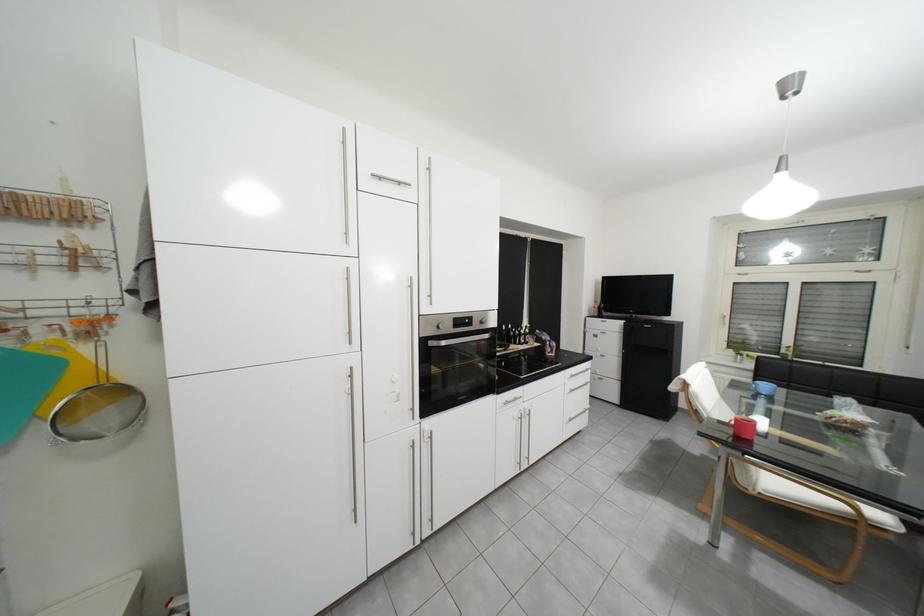
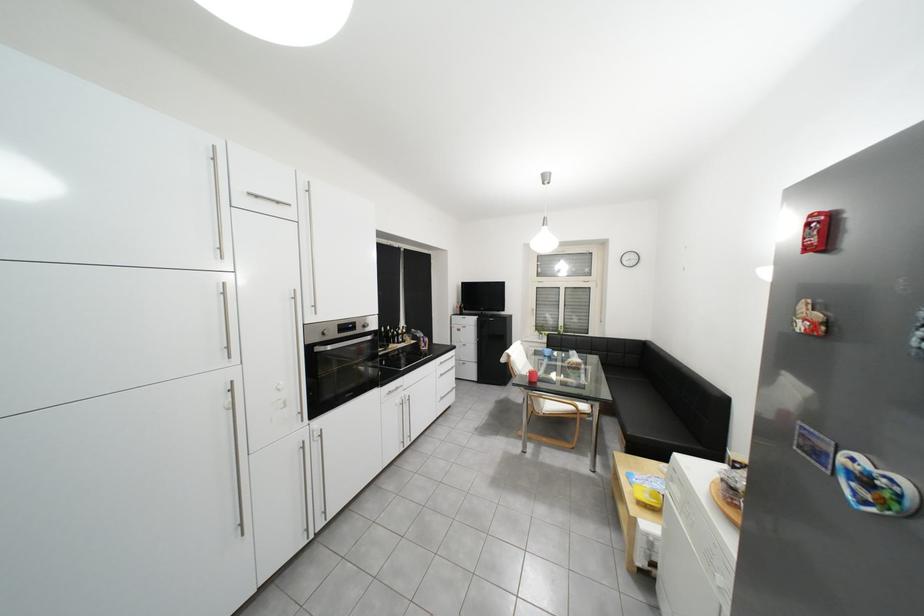
Locate, in the second image, the point that corresponds to (x=499, y=337) in the first image.

(381, 339)